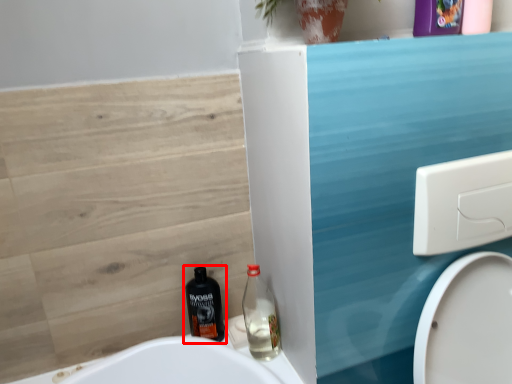
Question: From the image's perspective, where is bottle (annotated by the red box) located relative to bottle?

Choices:
 (A) below
 (B) above

Answer: (A)